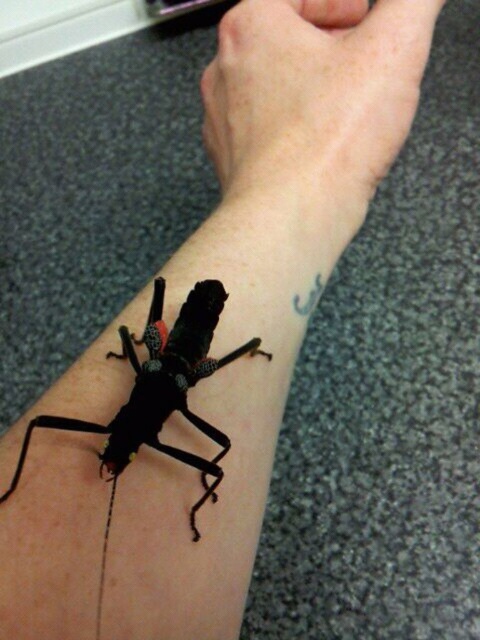
Question: Considering the relative positions of smooth skin at upper center and black matte insect at lower left in the image provided, where is smooth skin at upper center located with respect to black matte insect at lower left?

Choices:
 (A) right
 (B) left

Answer: (A)

Question: Which object is farther from the camera taking this photo?

Choices:
 (A) black matte insect at lower left
 (B) smooth skin at upper center

Answer: (B)

Question: Considering the relative positions of smooth skin at upper center and black matte insect at lower left in the image provided, where is smooth skin at upper center located with respect to black matte insect at lower left?

Choices:
 (A) right
 (B) left

Answer: (A)

Question: Which object appears closest to the camera in this image?

Choices:
 (A) black matte insect at lower left
 (B) smooth skin at upper center

Answer: (A)

Question: Can you confirm if smooth skin at upper center is bigger than black matte insect at lower left?

Choices:
 (A) no
 (B) yes

Answer: (B)